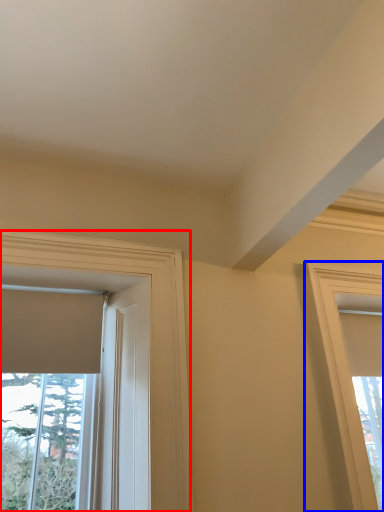
Question: Which object appears closest to the camera in this image, window (highlighted by a red box) or window (highlighted by a blue box)?

Choices:
 (A) window
 (B) window

Answer: (A)